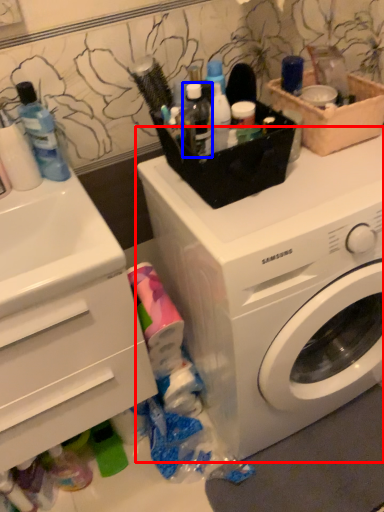
Question: Which object appears closest to the camera in this image, washing machine (highlighted by a red box) or toiletry (highlighted by a blue box)?

Choices:
 (A) washing machine
 (B) toiletry

Answer: (A)